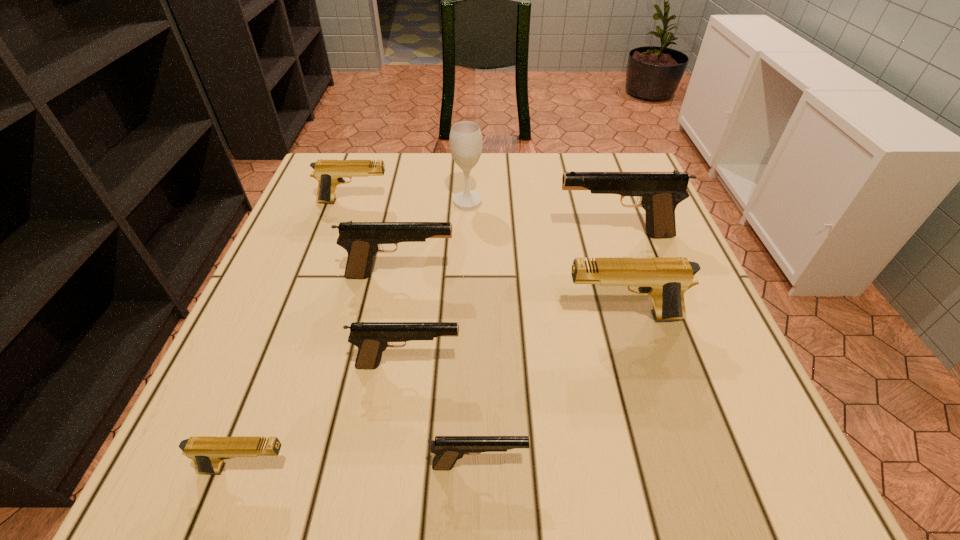
At what (x,y) coordinates should I click in order to perform the action: click on vacant space at the near edge. Please return your answer as a coordinate pair (x, y). Image resolution: width=960 pixels, height=540 pixels. Looking at the image, I should click on (307, 481).

The height and width of the screenshot is (540, 960). Find the location of `vacant region at the left edge of the desktop`. vacant region at the left edge of the desktop is located at coordinates (326, 319).

In order to click on free space at the right edge of the desktop in this screenshot , I will do `click(719, 377)`.

Find the location of `vacant area at the far left corner`. vacant area at the far left corner is located at coordinates (350, 192).

Find the location of a particular element. Image resolution: width=960 pixels, height=540 pixels. vacant space at the near right corner is located at coordinates (738, 461).

You are a GUI agent. You are given a task and a screenshot of the screen. Output one action in this format:
    pyautogui.click(x=<x>, y=<y>)
    Task: Click on the vacant area that lies between the tallest object and the second smallest tan pistol
    Image resolution: width=960 pixels, height=540 pixels.
    Given the screenshot: What is the action you would take?
    pyautogui.click(x=411, y=201)

Where is `free space between the biggest black pistol and the farthest pistol`? free space between the biggest black pistol and the farthest pistol is located at coordinates (484, 219).

Identify the location of free space between the second biggest tan pistol and the tallest object. The width and height of the screenshot is (960, 540). (411, 201).

What are the coordinates of `free space between the second smallest black pistol and the sixth nearest pistol` in the screenshot? It's located at (512, 300).

The width and height of the screenshot is (960, 540). Identify the location of free point between the second biggest black pistol and the second smallest black pistol. (404, 320).